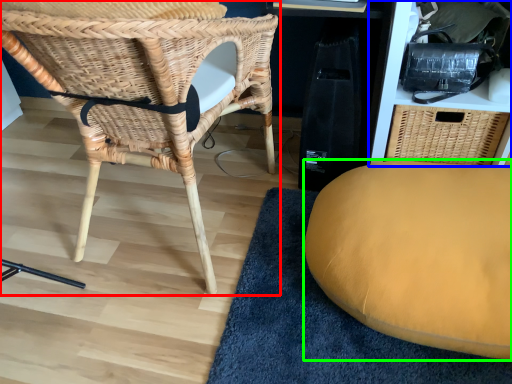
Question: Considering the real-world distances, which object is farthest from chair (highlighted by a red box)? shelf (highlighted by a blue box) or furniture (highlighted by a green box)?

Choices:
 (A) shelf
 (B) furniture

Answer: (A)